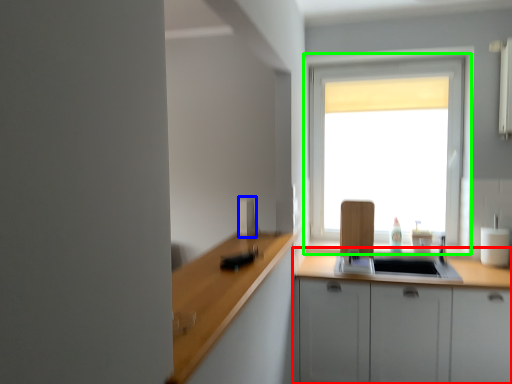
Question: Based on their relative distances, which object is nearer to cabinetry (highlighted by a red box)? Choose from appliance (highlighted by a blue box) and window (highlighted by a green box).

Choices:
 (A) appliance
 (B) window

Answer: (B)